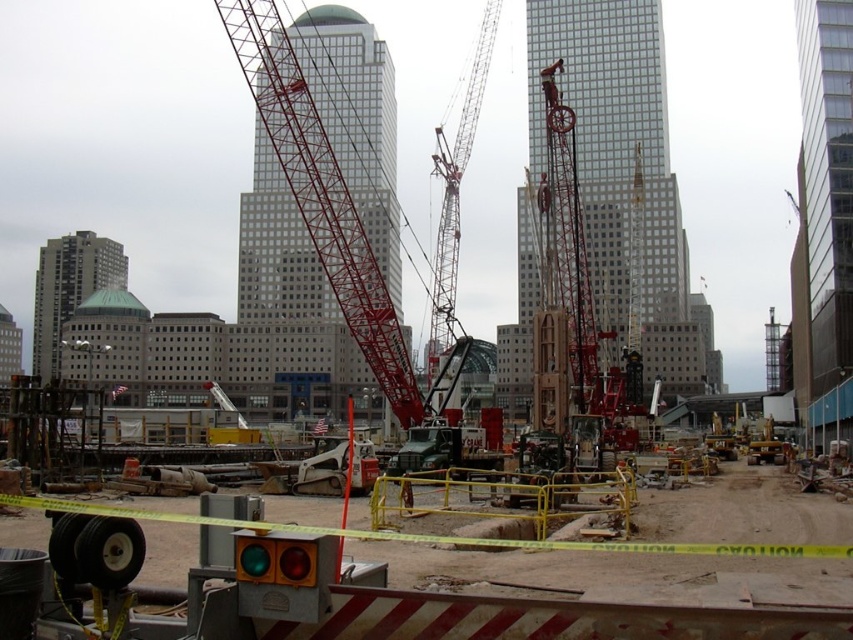
Question: Which of the following is the farthest from the observer?

Choices:
 (A) (833, 120)
 (B) (466, 163)
 (C) (350, 160)

Answer: (B)

Question: Does metallic red crane at center have a greater width compared to glassy reflective skyscraper at center?

Choices:
 (A) no
 (B) yes

Answer: (B)

Question: Estimate the real-world distances between objects in this image. Which object is farther from the metallic red crane at center?

Choices:
 (A) white glass skyscraper at center
 (B) yellow caution tape at center

Answer: (B)

Question: Does metallic red crane at center have a smaller size compared to white glass skyscraper at center?

Choices:
 (A) no
 (B) yes

Answer: (B)

Question: Is metallic red crane at center thinner than white glass skyscraper at center?

Choices:
 (A) yes
 (B) no

Answer: (B)

Question: Which object is closer to the camera taking this photo?

Choices:
 (A) metallic red crane at center
 (B) glassy reflective skyscraper at center

Answer: (B)